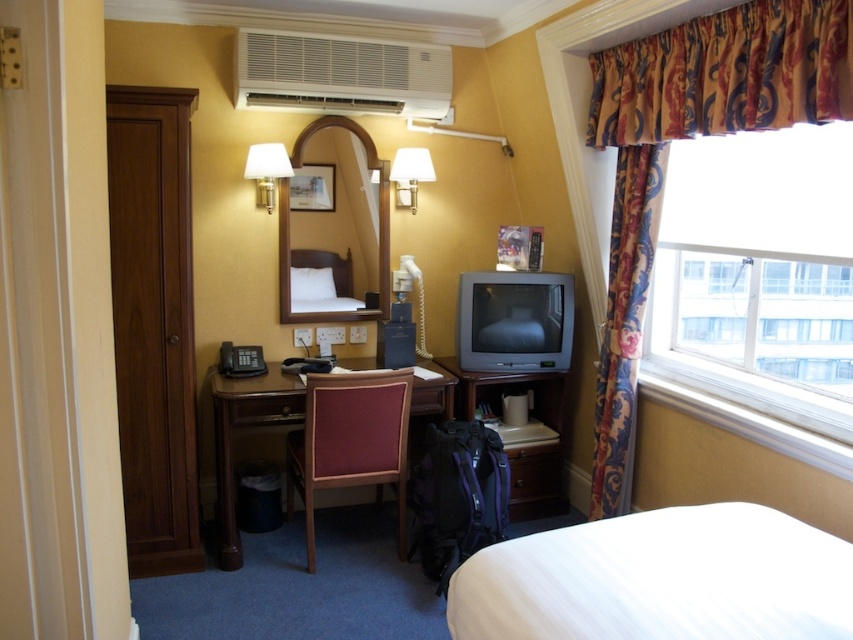
Between wooden desk at center and white matte wall lamp at upper left, which one is positioned lower?

Positioned lower is wooden desk at center.

Between point (286, 378) and point (265, 208), which one is positioned in front?

Point (286, 378)

Where is `wooden desk at center`? wooden desk at center is located at coordinates (245, 426).

Which is in front, point (631, 209) or point (260, 156)?

Point (631, 209)

Between patterned fabric curtain at upper right and white matte wall lamp at upper left, which one has less height?

Standing shorter between the two is white matte wall lamp at upper left.

Is point (625, 452) farther from camera compared to point (270, 156)?

No, it is not.

Find the location of a particular element. patterned fabric curtain at upper right is located at coordinates (689, 138).

Who is more distant from viewer, (651, 634) or (241, 72)?

Point (241, 72)

Can you confirm if white textured bed at lower right is wider than white plastic air conditioner at upper center?

Yes, white textured bed at lower right is wider than white plastic air conditioner at upper center.

Describe the element at coordinates (660, 579) in the screenshot. The width and height of the screenshot is (853, 640). I see `white textured bed at lower right` at that location.

The height and width of the screenshot is (640, 853). I want to click on white textured bed at lower right, so click(x=660, y=579).